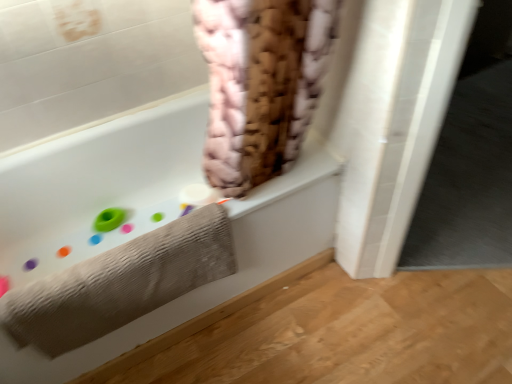
Question: Can you confirm if white matte bathtub at upper left is bigger than white matte toilet paper at upper center?

Choices:
 (A) no
 (B) yes

Answer: (B)

Question: Is white matte bathtub at upper left outside white matte toilet paper at upper center?

Choices:
 (A) no
 (B) yes

Answer: (B)

Question: Is white matte toilet paper at upper center at the back of white matte bathtub at upper left?

Choices:
 (A) no
 (B) yes

Answer: (B)

Question: Is white matte toilet paper at upper center located within white matte bathtub at upper left?

Choices:
 (A) yes
 (B) no

Answer: (A)

Question: Can you confirm if white matte bathtub at upper left is wider than white matte toilet paper at upper center?

Choices:
 (A) yes
 (B) no

Answer: (A)

Question: From the image's perspective, would you say white matte bathtub at upper left is positioned over white matte toilet paper at upper center?

Choices:
 (A) yes
 (B) no

Answer: (B)

Question: Is white matte bathtub at upper left thinner than gray textured towel at lower left?

Choices:
 (A) yes
 (B) no

Answer: (B)

Question: Is white matte bathtub at upper left in contact with gray textured towel at lower left?

Choices:
 (A) yes
 (B) no

Answer: (B)

Question: Considering the relative sizes of white matte bathtub at upper left and gray textured towel at lower left in the image provided, is white matte bathtub at upper left shorter than gray textured towel at lower left?

Choices:
 (A) no
 (B) yes

Answer: (A)

Question: Is white matte bathtub at upper left to the left of gray textured towel at lower left from the viewer's perspective?

Choices:
 (A) yes
 (B) no

Answer: (A)

Question: Does white matte bathtub at upper left contain gray textured towel at lower left?

Choices:
 (A) yes
 (B) no

Answer: (A)

Question: From a real-world perspective, is white matte bathtub at upper left on top of gray textured towel at lower left?

Choices:
 (A) no
 (B) yes

Answer: (A)

Question: Considering the relative positions of gray textured towel at lower left and white matte toilet paper at upper center in the image provided, is gray textured towel at lower left to the left of white matte toilet paper at upper center from the viewer's perspective?

Choices:
 (A) yes
 (B) no

Answer: (A)